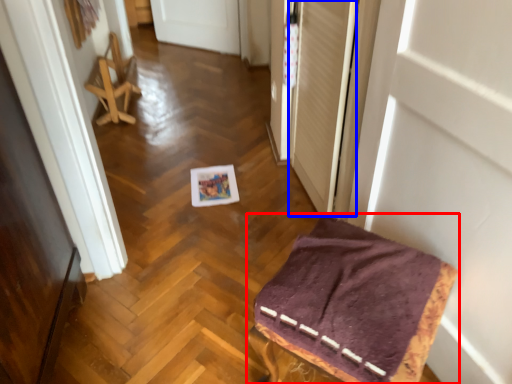
Question: Which point is closer to the camera, furniture (highlighted by a red box) or screen door (highlighted by a blue box)?

Choices:
 (A) furniture
 (B) screen door

Answer: (A)